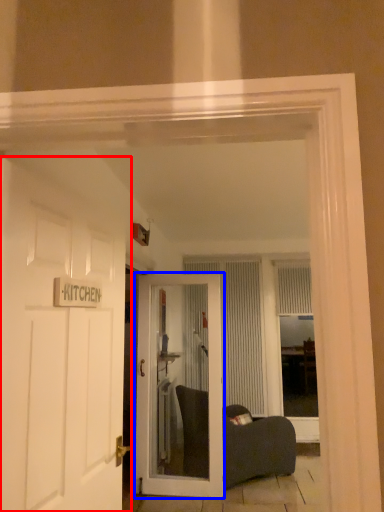
Question: Among these objects, which one is nearest to the camera, door (highlighted by a red box) or door (highlighted by a blue box)?

Choices:
 (A) door
 (B) door

Answer: (A)